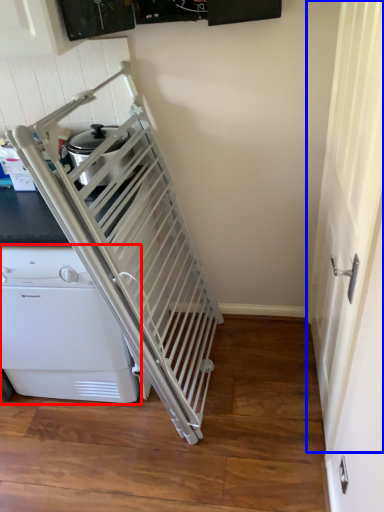
Question: Which object is closer to the camera taking this photo, home appliance (highlighted by a red box) or screen door (highlighted by a blue box)?

Choices:
 (A) home appliance
 (B) screen door

Answer: (B)